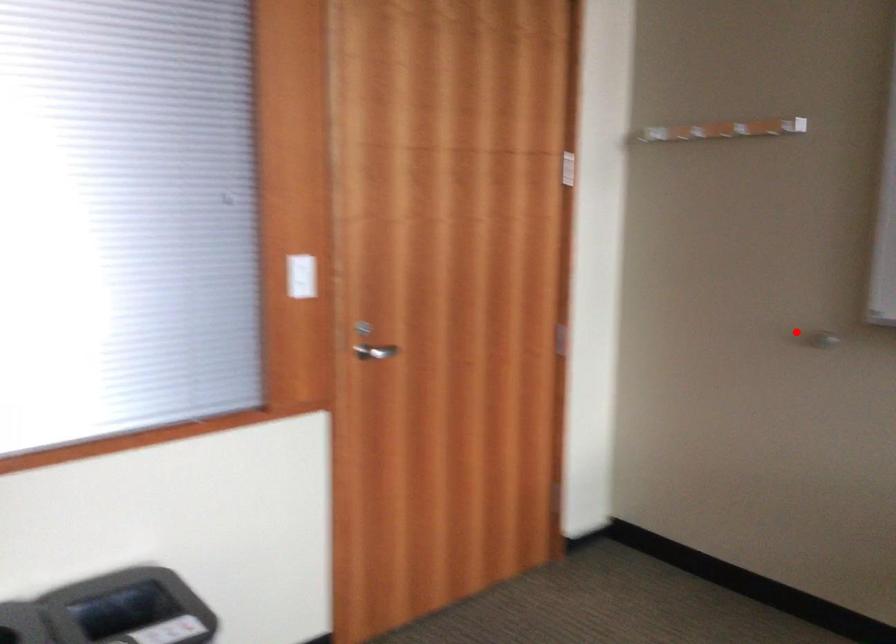
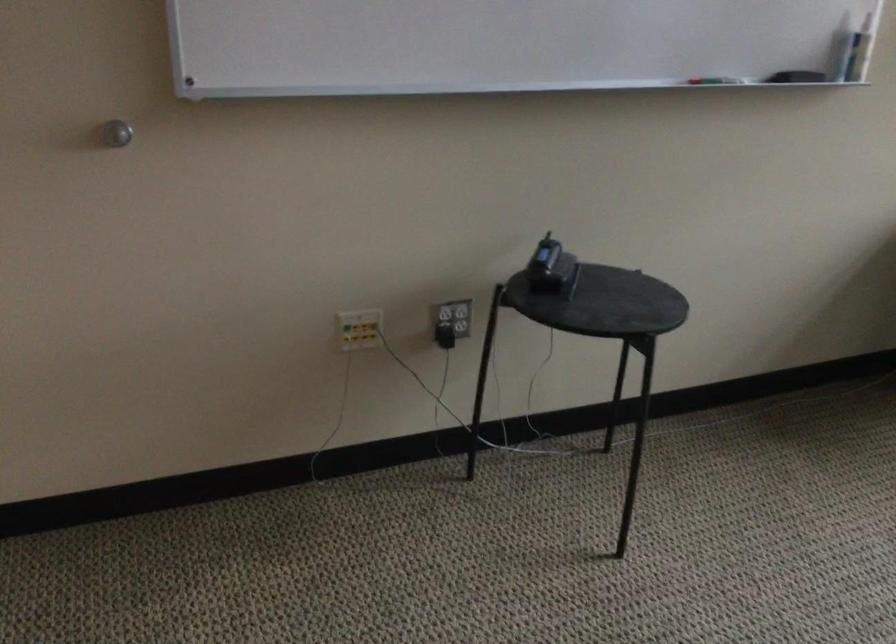
Locate, in the second image, the point that corresponds to the highlighted location in the first image.

(116, 133)